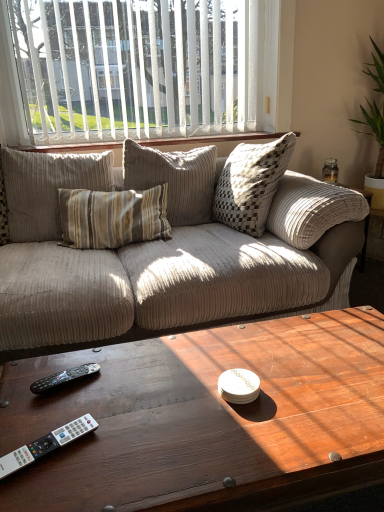
The height and width of the screenshot is (512, 384). Find the location of `free space in front of white plastic remote control at lower left, which ranks as the 2th remote control in back-to-front order`. free space in front of white plastic remote control at lower left, which ranks as the 2th remote control in back-to-front order is located at coordinates (42, 489).